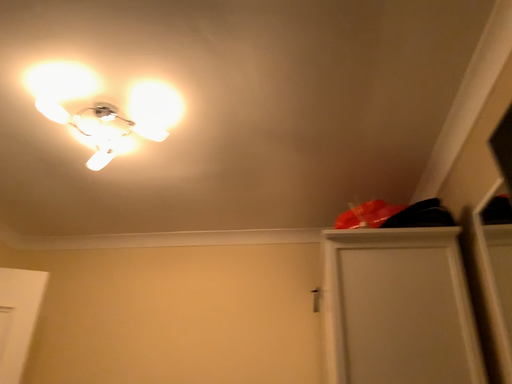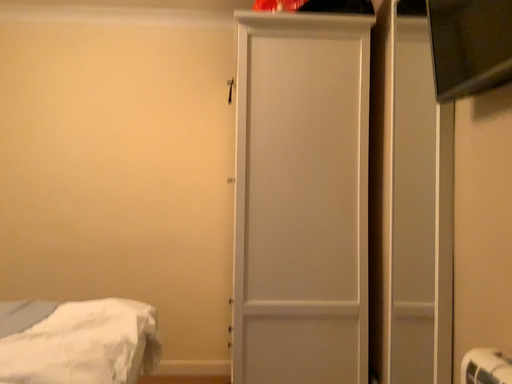
Question: Which way did the camera rotate in the video?

Choices:
 (A) rotated right
 (B) rotated left

Answer: (A)